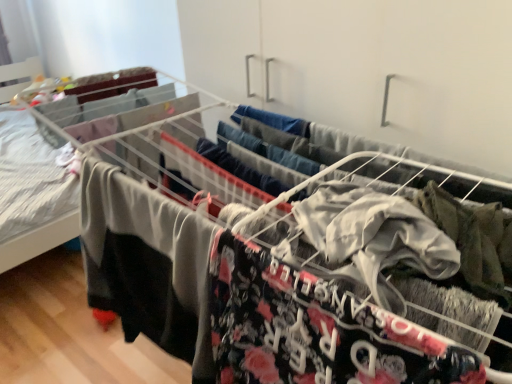
What do you see at coordinates (148, 263) in the screenshot? Image resolution: width=512 pixels, height=384 pixels. I see `gray fabric at center` at bounding box center [148, 263].

Locate an element on the screen. gray fabric at center is located at coordinates [x=148, y=263].

Measure the distance between gray fabric at center and camera.

A distance of 19.70 inches exists between gray fabric at center and camera.

Where is `gray fabric at center`? gray fabric at center is located at coordinates (148, 263).